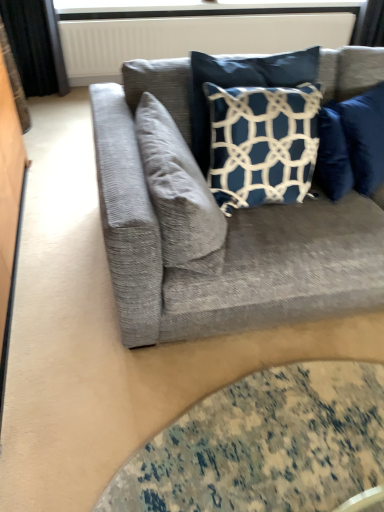
Question: Considering the positions of textured gray couch at center and white plastic window screen at upper center in the image, is textured gray couch at center bigger or smaller than white plastic window screen at upper center?

Choices:
 (A) small
 (B) big

Answer: (B)

Question: In the image, is textured gray couch at center positioned in front of or behind white plastic window screen at upper center?

Choices:
 (A) front
 (B) behind

Answer: (A)

Question: Estimate the real-world distances between objects in this image. Which object is closer to the white plastic window screen at upper center?

Choices:
 (A) white textured radiator at upper center
 (B) black fabric curtain at left
 (C) navy blue fabric pillow at upper right, which is counted as the second pillow, starting from the left
 (D) transparent glass table at lower center
 (E) textured gray couch at center

Answer: (A)

Question: Which of these objects is positioned closest to the white textured radiator at upper center?

Choices:
 (A) white textured pillow at center, positioned as the 1th pillow in left-to-right order
 (B) transparent glass table at lower center
 (C) black fabric curtain at left
 (D) textured gray couch at center
 (E) navy blue fabric pillow at upper right, marked as the first pillow in a right-to-left arrangement

Answer: (C)